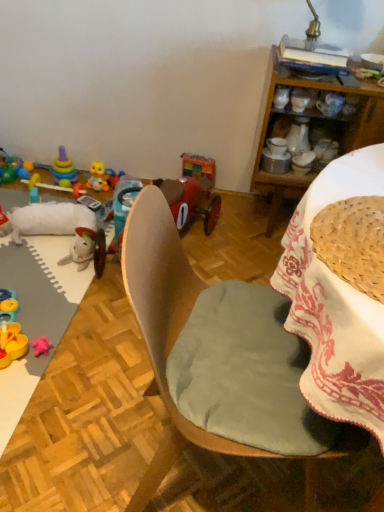
Locate an element on the screen. free space to the left of wooden chair at center is located at coordinates (79, 411).